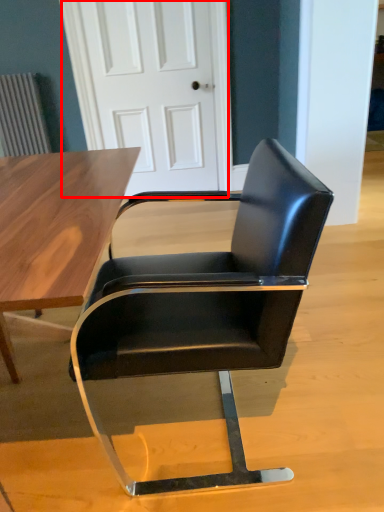
Question: Considering the relative positions of door (annotated by the red box) and chair in the image provided, where is door (annotated by the red box) located with respect to the staircase?

Choices:
 (A) right
 (B) left

Answer: (B)